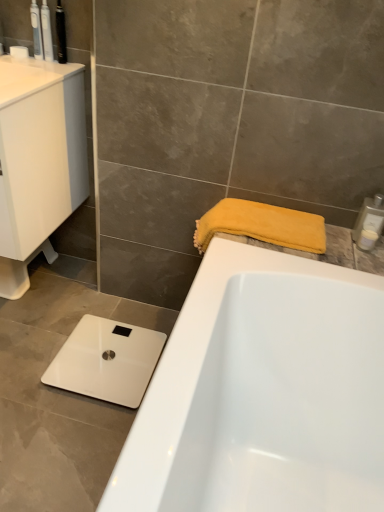
The width and height of the screenshot is (384, 512). I want to click on space that is in front of white plastic soap dispenser at upper right, which is the 5th toiletry in top-to-bottom order, so click(x=362, y=263).